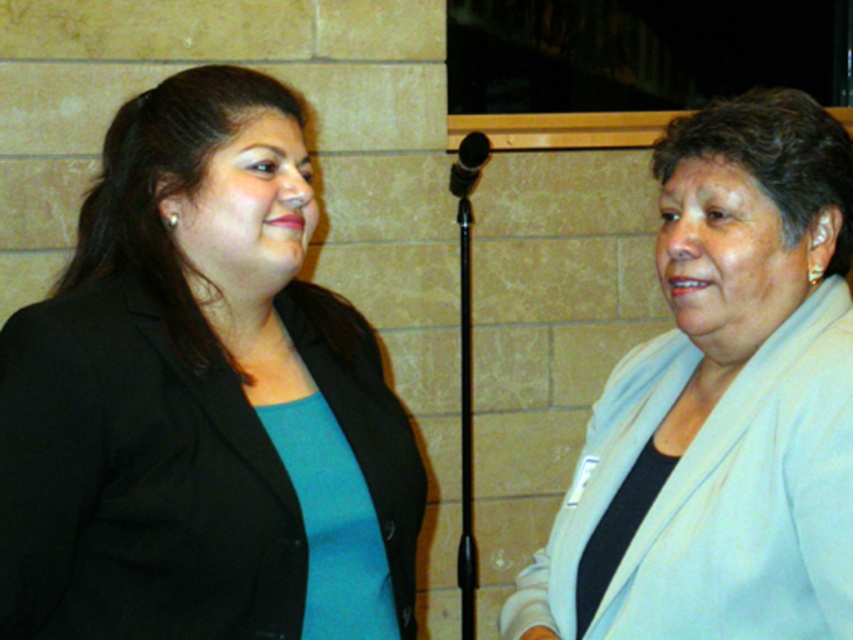
You are a photographer standing at the point marked as point (283, 444). You need to take a photo of both people so that they are both in the frame. The camera has a maximum angle of view of 60 degrees. Can you capture both people in a single photo without moving the camera?

The two individuals are 1.32 meters apart. Since the photographer is at point (283, 444), the distance between them falls within the camera angle of view of 60 degrees, so yes, both can be captured in a single photo.

You are a photographer at a formal event. You need to ensure that the matte black blazer at left and the light beige jacket at right are both visible in your photo. Considering their heights, which blazer should you adjust the camera angle to focus on to ensure both are fully captured?

The matte black blazer at left is much taller than the light beige jacket at right, so you should lower the camera angle to capture the taller matte black blazer at left while still including the shorter light beige jacket at right in the frame.

You are a photographer at this event and need to capture a group photo of the two people wearing the matte black blazer at left and the light beige jacket at right. The camera you are using has a minimum focusing distance of 16 inches. Will you need to adjust your position to ensure both subjects are in focus?

The matte black blazer at left and light beige jacket at right are 15.40 inches apart. Since the camera requires a minimum focusing distance of 16 inches, you will need to move slightly further back to ensure both subjects are within the camera range.